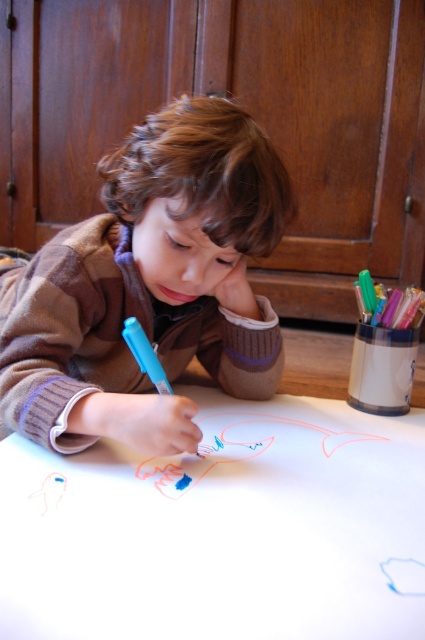
Question: Can you confirm if white paper at center is positioned to the right of matte brown sweater at center?

Choices:
 (A) yes
 (B) no

Answer: (A)

Question: From the image, what is the correct spatial relationship of white paper at center in relation to matte brown sweater at center?

Choices:
 (A) right
 (B) left

Answer: (A)

Question: Which point is farther to the camera?

Choices:
 (A) (45, 522)
 (B) (201, 97)

Answer: (B)

Question: Which object appears closest to the camera in this image?

Choices:
 (A) white paper at center
 (B) matte brown sweater at center

Answer: (A)

Question: Observing the image, what is the correct spatial positioning of white paper at center in reference to matte brown sweater at center?

Choices:
 (A) left
 (B) right

Answer: (B)